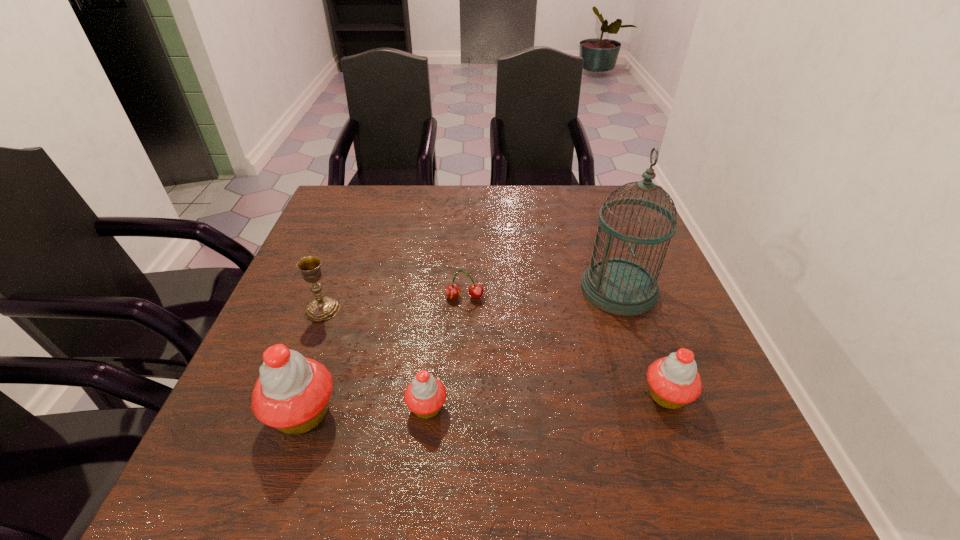
Where is `free location located with stems pointing upwards on the shortest object`? The height and width of the screenshot is (540, 960). free location located with stems pointing upwards on the shortest object is located at coordinates pyautogui.click(x=461, y=390).

Find the location of a particular element. This screenshot has width=960, height=540. vacant point located 0.070m on the back of the chalice is located at coordinates (334, 278).

Identify the location of vacant space located on the front-facing side of the tallest object. Image resolution: width=960 pixels, height=540 pixels. (552, 289).

Locate an element on the screen. The height and width of the screenshot is (540, 960). vacant space located 0.400m on the front-facing side of the tallest object is located at coordinates (415, 289).

At what (x,y) coordinates should I click in order to perform the action: click on blank space located on the front-facing side of the tallest object. Please return your answer as a coordinate pair (x, y). The image size is (960, 540). Looking at the image, I should click on (436, 289).

Find the location of a particular element. This screenshot has width=960, height=540. cupcake located in the left edge section of the desktop is located at coordinates (292, 394).

Where is `chalice present at the left edge`? This screenshot has height=540, width=960. chalice present at the left edge is located at coordinates (322, 308).

Locate an element on the screen. The width and height of the screenshot is (960, 540). cupcake at the right edge is located at coordinates (674, 381).

You are a GUI agent. You are given a task and a screenshot of the screen. Output one action in this format:
    pyautogui.click(x=<x>, y=<y>)
    Task: Click on the birdcage present at the right edge
    
    Given the screenshot: What is the action you would take?
    619,286

What are the coordinates of `object present at the near left corner` in the screenshot? It's located at (292, 394).